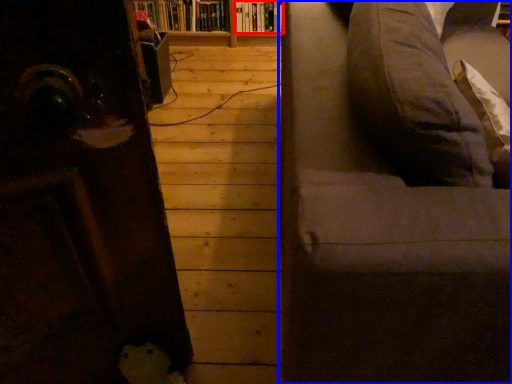
Question: Which point is further to the camera, book (highlighted by a red box) or studio couch (highlighted by a blue box)?

Choices:
 (A) book
 (B) studio couch

Answer: (A)